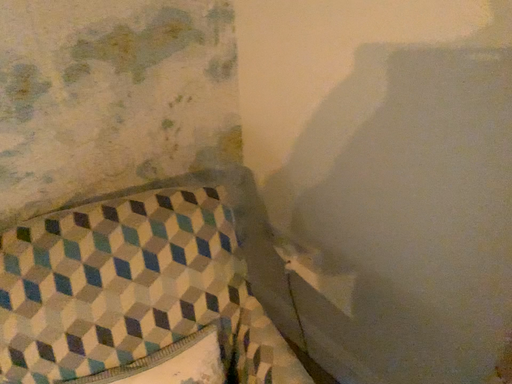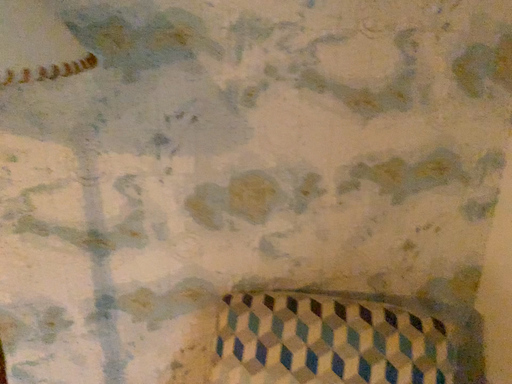
Question: Which way did the camera rotate in the video?

Choices:
 (A) rotated right
 (B) rotated left

Answer: (B)